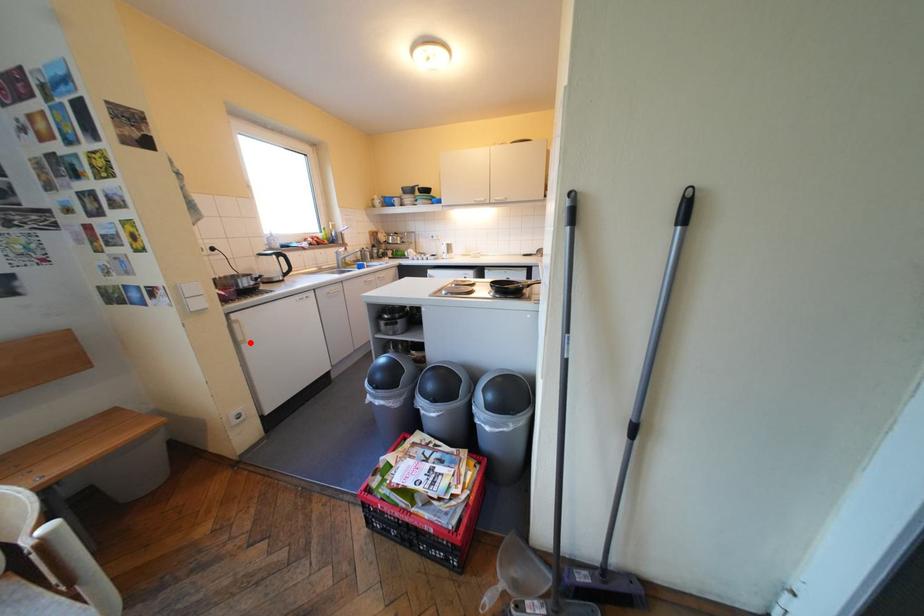
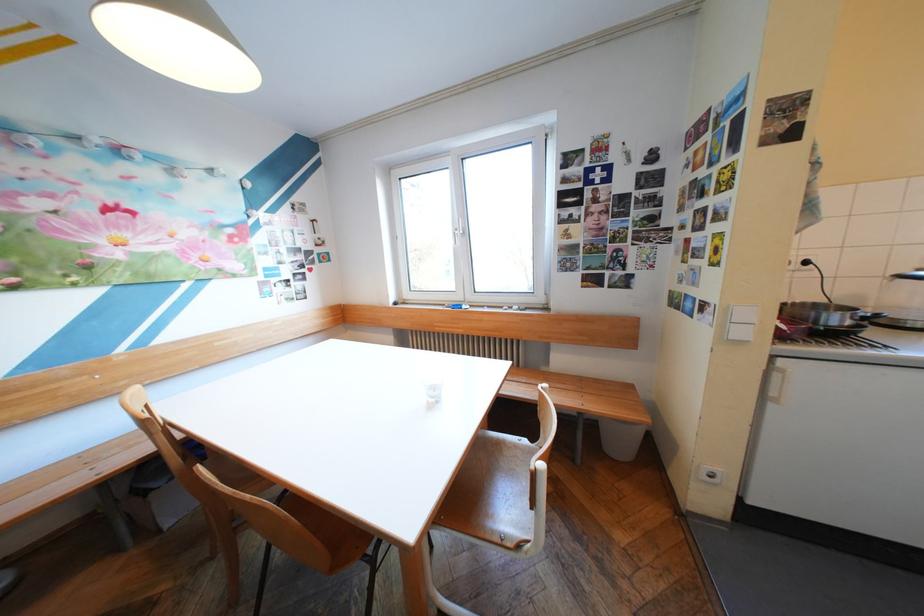
Question: I am providing you with two images of the same scene from different viewpoints. In image1, a red point is highlighted. Considering the same 3D point in image2, which of the following is correct?

Choices:
 (A) It is closer
 (B) It is farther

Answer: (B)